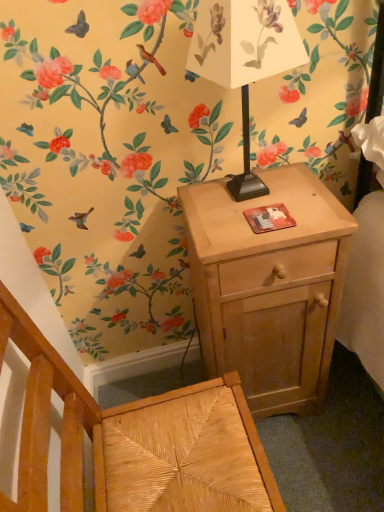
Locate an element on the screen. light wood nightstand at right is located at coordinates (269, 287).

Considering the relative sizes of woven wood armchair at lower left and white paper lampshade at upper center in the image provided, is woven wood armchair at lower left thinner than white paper lampshade at upper center?

No.

Is woven wood armchair at lower left behind white paper lampshade at upper center?

That is False.

In terms of height, does woven wood armchair at lower left look taller or shorter compared to white paper lampshade at upper center?

Considering their sizes, woven wood armchair at lower left has more height than white paper lampshade at upper center.

Which is behind, point (132, 484) or point (286, 58)?

Positioned behind is point (132, 484).

From a real-world perspective, is light wood nightstand at right positioned above or below woven wood armchair at lower left?

Clearly, from a real-world perspective, light wood nightstand at right is below woven wood armchair at lower left.

Is light wood nightstand at right wider or thinner than woven wood armchair at lower left?

In the image, light wood nightstand at right appears to be more narrow than woven wood armchair at lower left.

Is light wood nightstand at right next to woven wood armchair at lower left and touching it?

light wood nightstand at right and woven wood armchair at lower left are not in contact.

Is white paper lampshade at upper center looking in the opposite direction of light wood nightstand at right?

white paper lampshade at upper center does not have its back to light wood nightstand at right.

From their relative heights in the image, would you say white paper lampshade at upper center is taller or shorter than light wood nightstand at right?

Clearly, white paper lampshade at upper center is shorter compared to light wood nightstand at right.

Does white paper lampshade at upper center touch light wood nightstand at right?

No, white paper lampshade at upper center is not in contact with light wood nightstand at right.

From a real-world perspective, does white paper lampshade at upper center sit lower than light wood nightstand at right?

Incorrect, from a real-world perspective, white paper lampshade at upper center is higher than light wood nightstand at right.

Considering the relative sizes of light wood nightstand at right and white paper lampshade at upper center in the image provided, is light wood nightstand at right taller than white paper lampshade at upper center?

Yes, light wood nightstand at right is taller than white paper lampshade at upper center.

Is light wood nightstand at right wider than white paper lampshade at upper center?

Yes.

What's the angular difference between light wood nightstand at right and white paper lampshade at upper center's facing directions?

The angle between the facing direction of light wood nightstand at right and the facing direction of white paper lampshade at upper center is 3.87 degrees.

Between point (310, 319) and point (252, 16), which one is positioned behind?

The point (310, 319) is farther from the camera.

Considering the sizes of objects white paper lampshade at upper center and woven wood armchair at lower left in the image provided, who is thinner, white paper lampshade at upper center or woven wood armchair at lower left?

Thinner between the two is white paper lampshade at upper center.

Does white paper lampshade at upper center appear on the right side of woven wood armchair at lower left?

Indeed, white paper lampshade at upper center is positioned on the right side of woven wood armchair at lower left.

Is woven wood armchair at lower left completely or partially inside white paper lampshade at upper center?

No, woven wood armchair at lower left is located outside of white paper lampshade at upper center.

Could you tell me if white paper lampshade at upper center is facing woven wood armchair at lower left?

No, white paper lampshade at upper center does not turn towards woven wood armchair at lower left.

Is woven wood armchair at lower left far away from light wood nightstand at right?

Actually, woven wood armchair at lower left and light wood nightstand at right are a little close together.

In terms of size, does woven wood armchair at lower left appear bigger or smaller than light wood nightstand at right?

Considering their sizes, woven wood armchair at lower left takes up more space than light wood nightstand at right.

How distant is woven wood armchair at lower left from light wood nightstand at right?

woven wood armchair at lower left and light wood nightstand at right are 12.79 inches apart from each other.

The height and width of the screenshot is (512, 384). Identify the location of armchair in front of the white paper lampshade at upper center. (136, 440).

Identify the location of nightstand on the right of woven wood armchair at lower left. (269, 287).

Estimate the real-world distances between objects in this image. Which object is further from woven wood armchair at lower left, white paper lampshade at upper center or light wood nightstand at right?

white paper lampshade at upper center.

From the image, which object appears to be nearer to woven wood armchair at lower left, light wood nightstand at right or white paper lampshade at upper center?

Among the two, light wood nightstand at right is located nearer to woven wood armchair at lower left.

Considering their positions, is woven wood armchair at lower left positioned further to white paper lampshade at upper center than light wood nightstand at right?

woven wood armchair at lower left is positioned further to the anchor white paper lampshade at upper center.

Which object lies further to the anchor point light wood nightstand at right, woven wood armchair at lower left or white paper lampshade at upper center?

white paper lampshade at upper center is positioned further to the anchor light wood nightstand at right.

From the image, which object appears to be farther from white paper lampshade at upper center, light wood nightstand at right or woven wood armchair at lower left?

Among the two, woven wood armchair at lower left is located further to white paper lampshade at upper center.

Considering their positions, is white paper lampshade at upper center positioned closer to light wood nightstand at right than woven wood armchair at lower left?

Among the two, woven wood armchair at lower left is located nearer to light wood nightstand at right.

At what (x,y) coordinates should I click in order to perform the action: click on nightstand between white paper lampshade at upper center and woven wood armchair at lower left in the vertical direction. Please return your answer as a coordinate pair (x, y). The image size is (384, 512). Looking at the image, I should click on pyautogui.click(x=269, y=287).